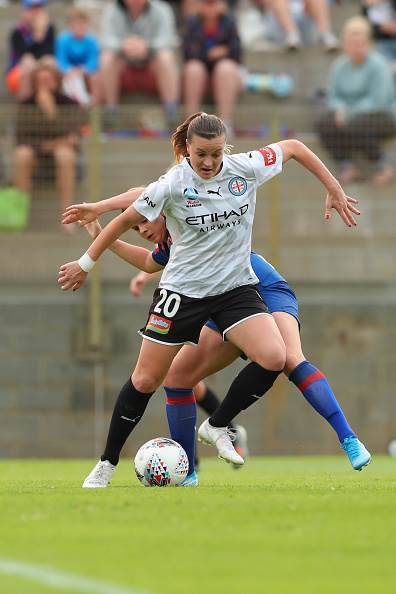
You are a GUI agent. You are given a task and a screenshot of the screen. Output one action in this format:
    pyautogui.click(x=<x>, y=<y>)
    Task: Click on the sock
    The width and height of the screenshot is (396, 594).
    Given the screenshot: What is the action you would take?
    pyautogui.click(x=120, y=425)